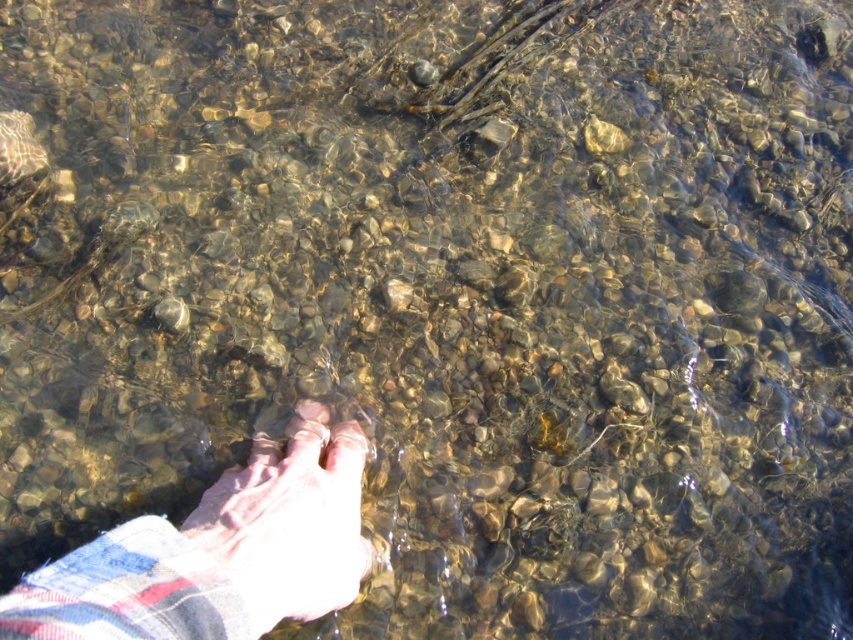
Question: Which point appears closest to the camera in this image?

Choices:
 (A) (223, 556)
 (B) (334, 442)
 (C) (262, 572)

Answer: (A)

Question: Can you confirm if plaid fabric hand at lower left is bigger than pink fabric foot at center?

Choices:
 (A) yes
 (B) no

Answer: (A)

Question: Among these points, which one is nearest to the camera?

Choices:
 (A) (180, 528)
 (B) (334, 604)

Answer: (A)

Question: Does pink fabric foot at center have a larger size compared to pink flesh at center?

Choices:
 (A) yes
 (B) no

Answer: (A)

Question: Which point is farther to the camera?

Choices:
 (A) plaid fabric hand at lower left
 (B) pink flesh at center

Answer: (B)

Question: Is plaid fabric hand at lower left to the right of pink fabric foot at center from the viewer's perspective?

Choices:
 (A) yes
 (B) no

Answer: (B)